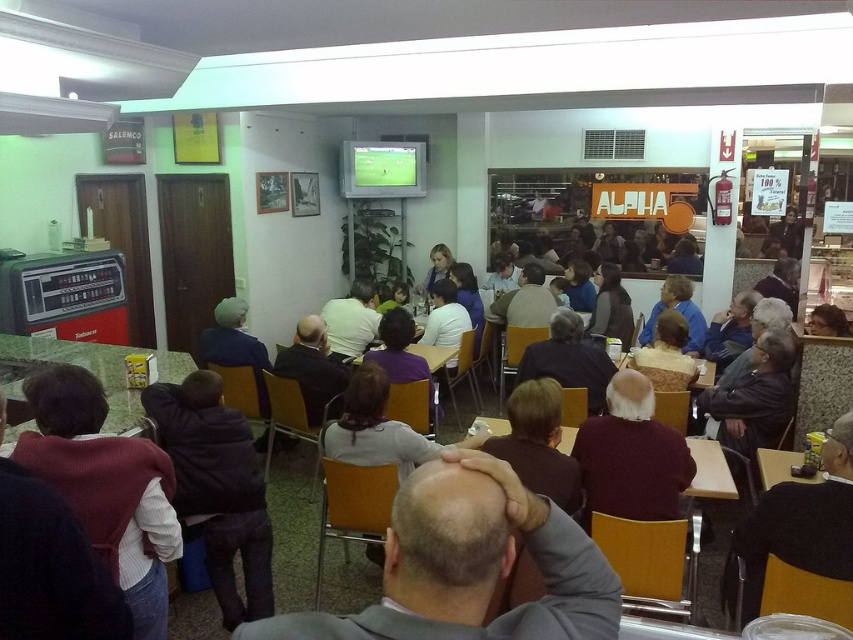
Who is taller, dark brown jacket at center or matte plastic table at lower left?

With more height is dark brown jacket at center.

Which is in front, point (230, 595) or point (77, 364)?

Point (230, 595) is in front.

What do you see at coordinates (216, 488) in the screenshot?
I see `dark brown jacket at center` at bounding box center [216, 488].

At what (x,y) coordinates should I click in order to perform the action: click on dark brown jacket at center. Please return your answer as a coordinate pair (x, y). This screenshot has height=640, width=853. Looking at the image, I should click on (216, 488).

Between matte plastic table at lower left and wooden table at center, which one has more height?

matte plastic table at lower left

Who is lower down, matte plastic table at lower left or wooden table at center?

matte plastic table at lower left

Is point (160, 376) more distant than point (399, 353)?

No, it is not.

The height and width of the screenshot is (640, 853). I want to click on matte plastic table at lower left, so click(97, 369).

Between dark brown hair at center and wooden table at center, which one has less height?

wooden table at center

Can you confirm if dark brown hair at center is thinner than wooden table at center?

Indeed, dark brown hair at center has a lesser width compared to wooden table at center.

What do you see at coordinates (538, 444) in the screenshot? I see `dark brown hair at center` at bounding box center [538, 444].

At what (x,y) coordinates should I click in order to perform the action: click on dark brown hair at center. Please return your answer as a coordinate pair (x, y). The height and width of the screenshot is (640, 853). Looking at the image, I should click on (538, 444).